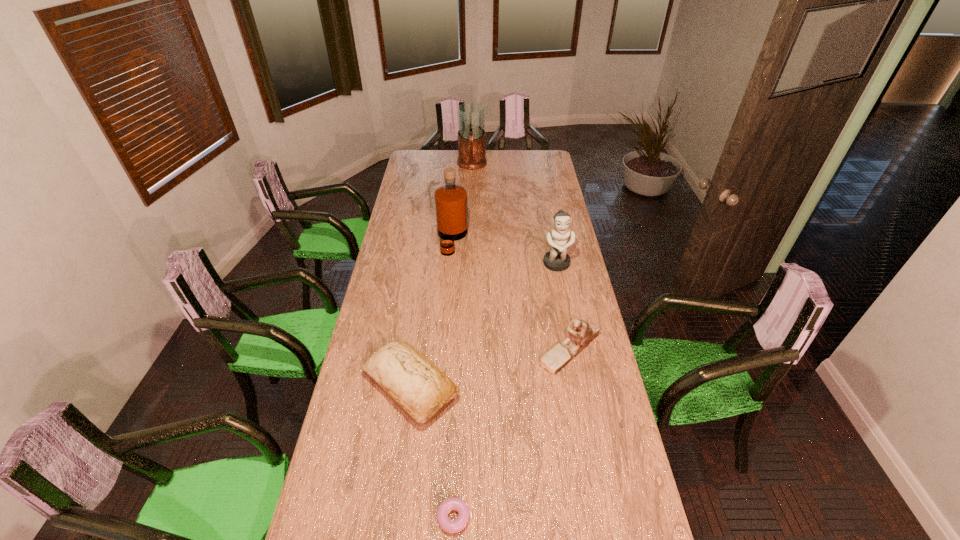
Locate an element on the screen. This screenshot has width=960, height=540. the farthest object is located at coordinates (471, 116).

Where is `liquor`? The width and height of the screenshot is (960, 540). liquor is located at coordinates (451, 206).

I want to click on the third tallest object, so click(557, 259).

Find the location of `the farther figurine`. the farther figurine is located at coordinates (557, 259).

You are a GUI agent. You are given a task and a screenshot of the screen. Output one action in this format:
    pyautogui.click(x=<x>, y=<y>)
    Task: Click on the nearer figurine
    The height and width of the screenshot is (540, 960).
    Given the screenshot: What is the action you would take?
    pyautogui.click(x=580, y=334)

This screenshot has width=960, height=540. I want to click on bread, so 412,381.

Where is `doughnut`? This screenshot has height=540, width=960. doughnut is located at coordinates (451, 526).

Identify the location of the shortest object. (451, 526).

I want to click on vacant space situated 0.220m with the handle on the side of the farthest object, so click(471, 195).

At what (x,y) coordinates should I click in order to perform the action: click on vacant space located on the front label of the liquor. Please return your answer as a coordinate pair (x, y). This screenshot has width=960, height=540. Looking at the image, I should click on (513, 239).